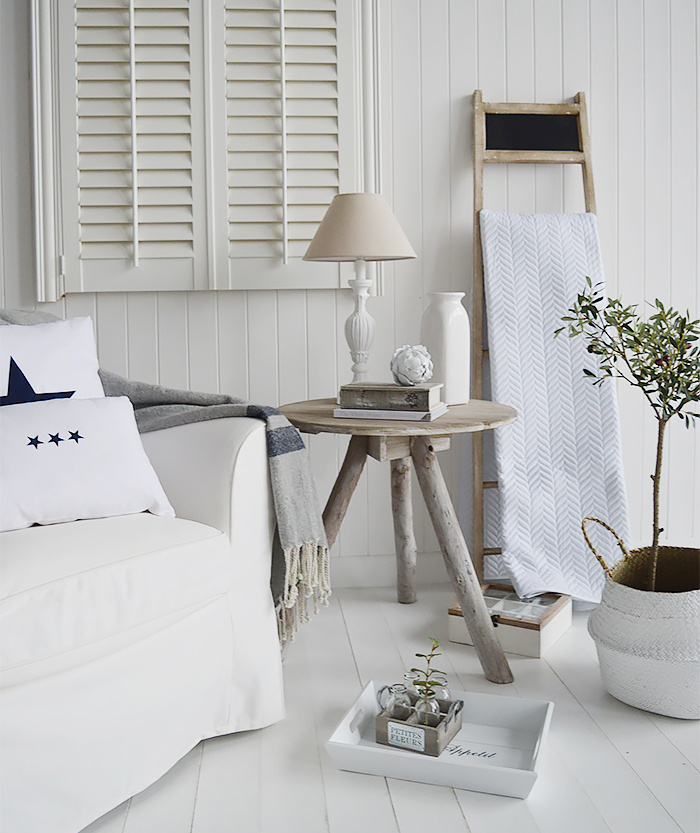
The image size is (700, 833). In order to click on couch in this screenshot , I will do `click(89, 555)`.